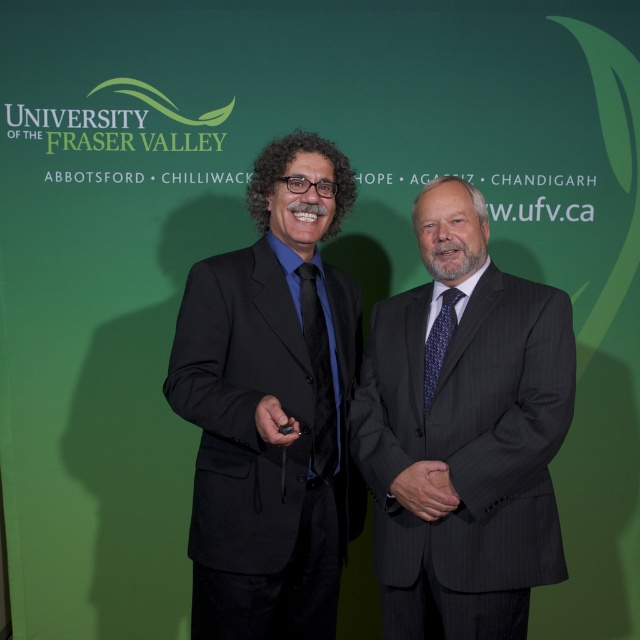
Image resolution: width=640 pixels, height=640 pixels. What do you see at coordinates (272, 404) in the screenshot? I see `black matte suit at center` at bounding box center [272, 404].

Who is more forward, (x=196, y=531) or (x=428, y=362)?

Point (x=196, y=531)

Is point (289, 316) closer to camera compared to point (429, 342)?

Yes, it is.

This screenshot has width=640, height=640. I want to click on black matte suit at center, so click(x=272, y=404).

Which is below, dark gray pinstripe suit at center or black matte suit at center?

dark gray pinstripe suit at center is below.

Is the position of dark gray pinstripe suit at center less distant than that of black matte suit at center?

No.

Where is `dark gray pinstripe suit at center`? dark gray pinstripe suit at center is located at coordinates (464, 433).

Does matte black tie at center have a lesser height compared to blue textured tie at center?

No, matte black tie at center is not shorter than blue textured tie at center.

Between matte black tie at center and blue textured tie at center, which one appears on the left side from the viewer's perspective?

Positioned to the left is matte black tie at center.

Does point (305, 337) come in front of point (435, 360)?

No.

The width and height of the screenshot is (640, 640). I want to click on matte black tie at center, so click(317, 372).